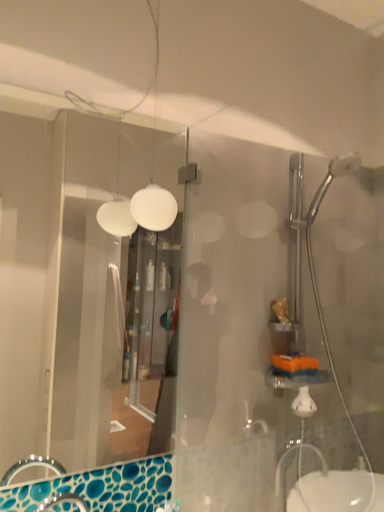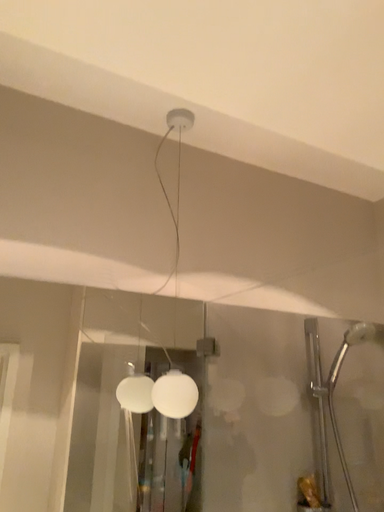
Question: Which way did the camera rotate in the video?

Choices:
 (A) rotated downward
 (B) rotated upward

Answer: (B)